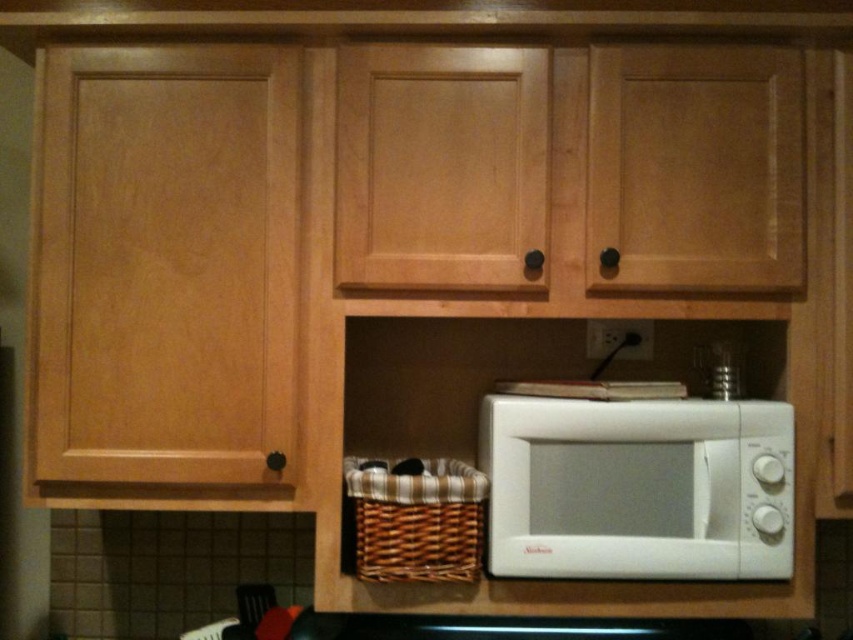
Which is more to the left, white matte microwave at lower right or woven brown basket at lower center?

From the viewer's perspective, woven brown basket at lower center appears more on the left side.

Which is more to the right, white matte microwave at lower right or woven brown basket at lower center?

From the viewer's perspective, white matte microwave at lower right appears more on the right side.

Find the location of `white matte microwave at lower right`. white matte microwave at lower right is located at coordinates (637, 486).

I want to click on white matte microwave at lower right, so [x=637, y=486].